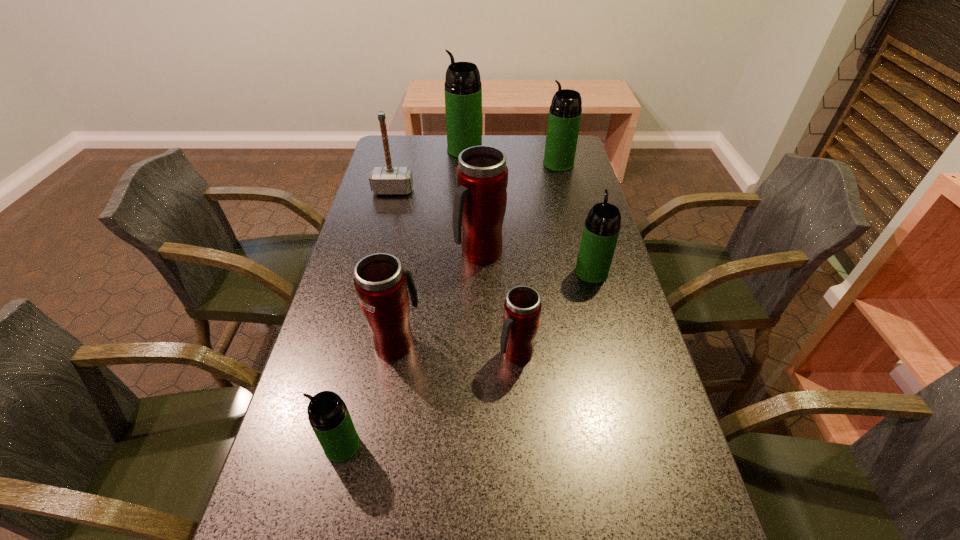
Identify the location of vacant region located 0.170m from the spout of the second nearest green thermos bottle. The image size is (960, 540). (579, 224).

At what (x,y) coordinates should I click in order to perform the action: click on free location located from the spout of the second nearest green thermos bottle. Please return your answer as a coordinate pair (x, y). This screenshot has width=960, height=540. Looking at the image, I should click on (582, 234).

Locate an element on the screen. Image resolution: width=960 pixels, height=540 pixels. free spot located 0.300m on the side with the handle of the second biggest red thermos bottle is located at coordinates (413, 243).

I want to click on vacant area located on the side with the handle of the second biggest red thermos bottle, so click(x=407, y=276).

You are a GUI agent. You are given a task and a screenshot of the screen. Output one action in this format:
    pyautogui.click(x=<x>, y=<y>)
    Task: Click on the free space located 0.210m on the side with the handle of the second biggest red thermos bottle
    This screenshot has height=540, width=960.
    Given the screenshot: What is the action you would take?
    pyautogui.click(x=409, y=264)

Where is `vacant space located 0.190m on the side with the handle of the smallest red thermos bottle`? vacant space located 0.190m on the side with the handle of the smallest red thermos bottle is located at coordinates (524, 455).

In order to click on blank space located from the spout of the smallest green thermos bottle in this screenshot , I will do `click(294, 446)`.

You are a GUI agent. You are given a task and a screenshot of the screen. Output one action in this format:
    pyautogui.click(x=<x>, y=<y>)
    Task: Click on the hammer located in the left edge section of the desktop
    
    Given the screenshot: What is the action you would take?
    pyautogui.click(x=383, y=180)

This screenshot has height=540, width=960. Find the location of `object present at the far right corner`. object present at the far right corner is located at coordinates (565, 112).

This screenshot has width=960, height=540. I want to click on vacant space at the far edge, so click(429, 161).